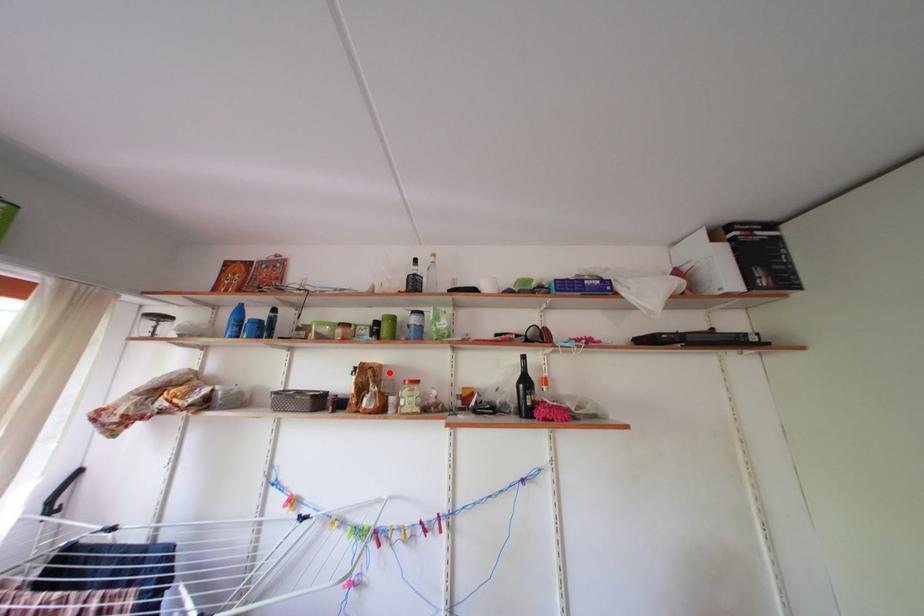
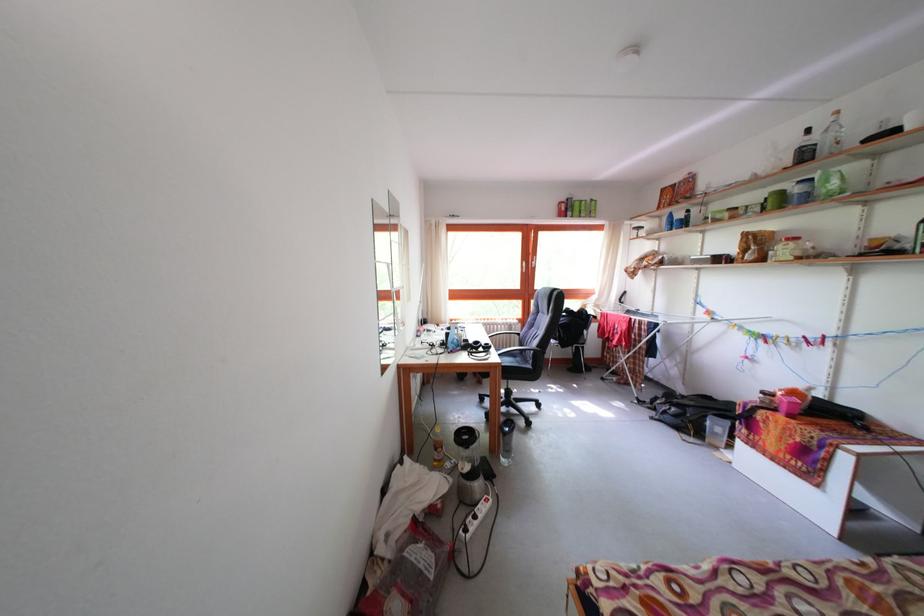
Question: I am providing you with two images of the same scene from different viewpoints. In image1, a red point is highlighted. Considering the same 3D point in image2, which of the following is correct?

Choices:
 (A) It is closer
 (B) It is farther

Answer: (A)